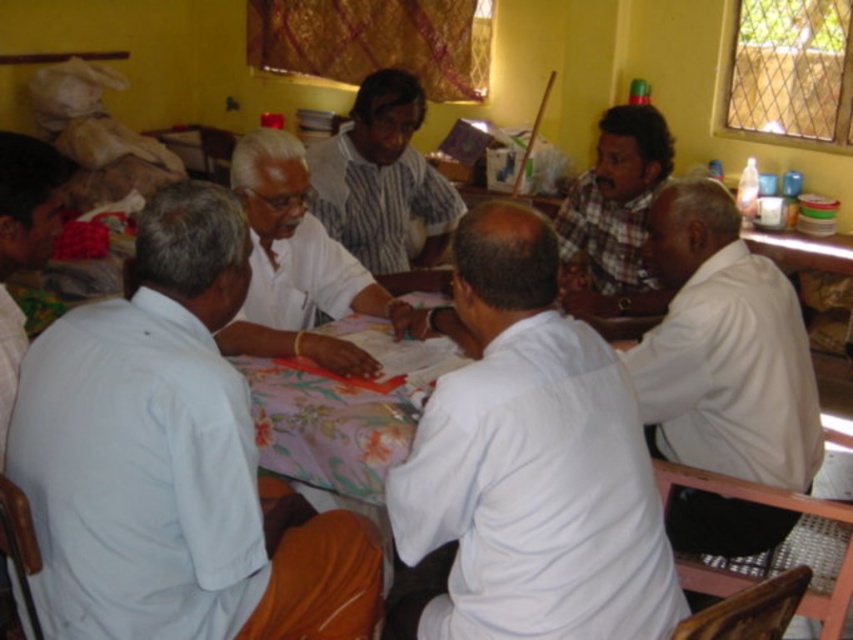
Question: Which point appears closest to the camera in this image?

Choices:
 (A) (28, 259)
 (B) (543, 616)
 (C) (50, 488)

Answer: (B)

Question: Considering the relative positions of light blue cotton shirt at left and white matte shirt at center in the image provided, where is light blue cotton shirt at left located with respect to white matte shirt at center?

Choices:
 (A) left
 (B) right

Answer: (A)

Question: Which of the following is the farthest from the observer?

Choices:
 (A) click(x=326, y=365)
 (B) click(x=520, y=211)
 (C) click(x=703, y=429)
 (D) click(x=38, y=220)

Answer: (A)

Question: Which point appears closest to the camera in this image?

Choices:
 (A) (22, 364)
 (B) (596, 305)
 (C) (361, 260)

Answer: (A)

Question: Is light blue cotton shirt at left above white matte shirt at right?

Choices:
 (A) yes
 (B) no

Answer: (B)

Question: Does light blue cotton shirt at left appear on the left side of striped cotton shirt at center?

Choices:
 (A) no
 (B) yes

Answer: (B)